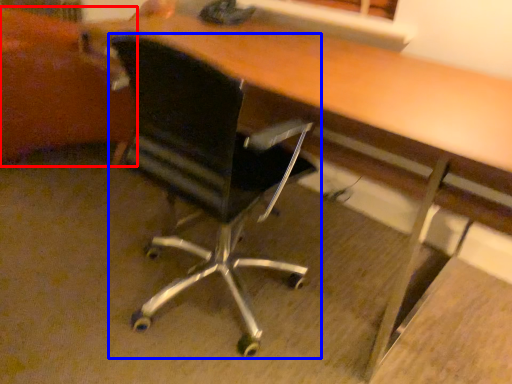
Question: Which object appears farthest to the camera in this image, swivel chair (highlighted by a red box) or chair (highlighted by a blue box)?

Choices:
 (A) swivel chair
 (B) chair

Answer: (A)